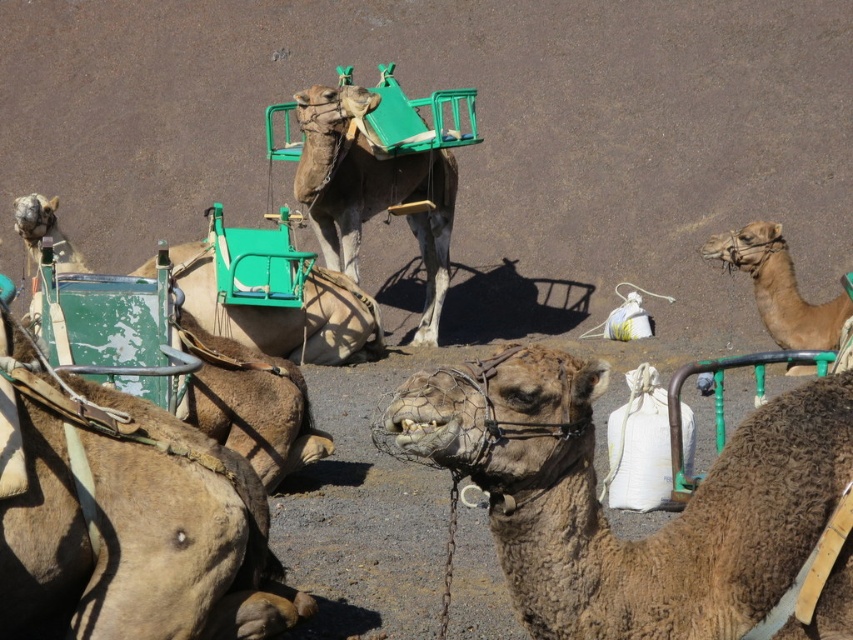
You are a tour guide leading a group of visitors to the desert. You need to choose a camel for a short ride. Which camel between the brown textured camel at center and the light brown leather camel at upper left would you recommend for better comfort and stability?

The brown textured camel at center has a larger size compared to the light brown leather camel at upper left, so it would provide better comfort and stability for the ride.

You are a tour guide leading a group to observe camels in a desert. You notice two camels in the scene, the brown textured camel at center and the light brown fur camel at right. Which camel is taller?

The brown textured camel at center is taller than the light brown fur camel at right.

You are a tourist standing in the desert and see the brown textured camel at center and the light brown leather camel at upper left. Which camel is positioned higher in the image?

The brown textured camel at center is positioned higher in the image than the light brown leather camel at upper left according to the description.